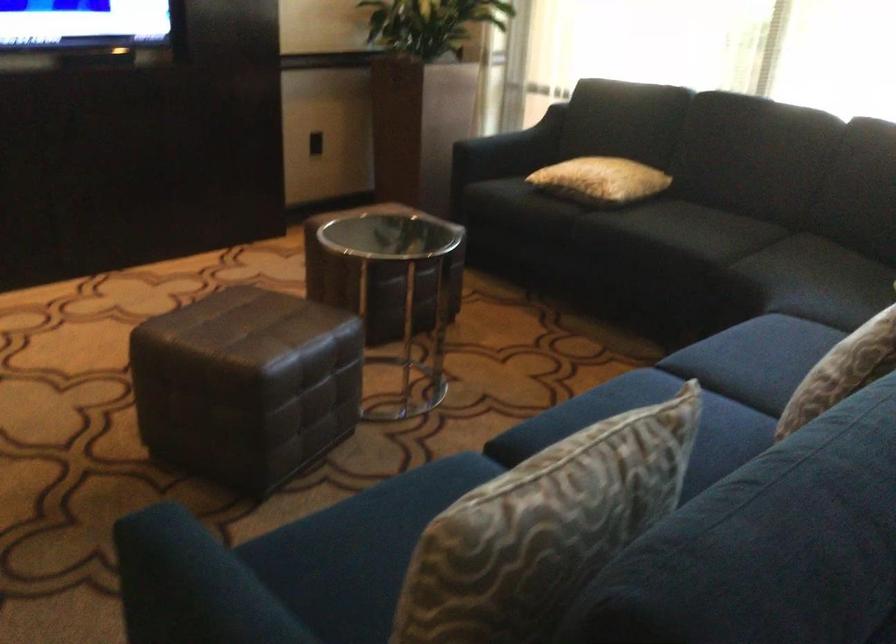
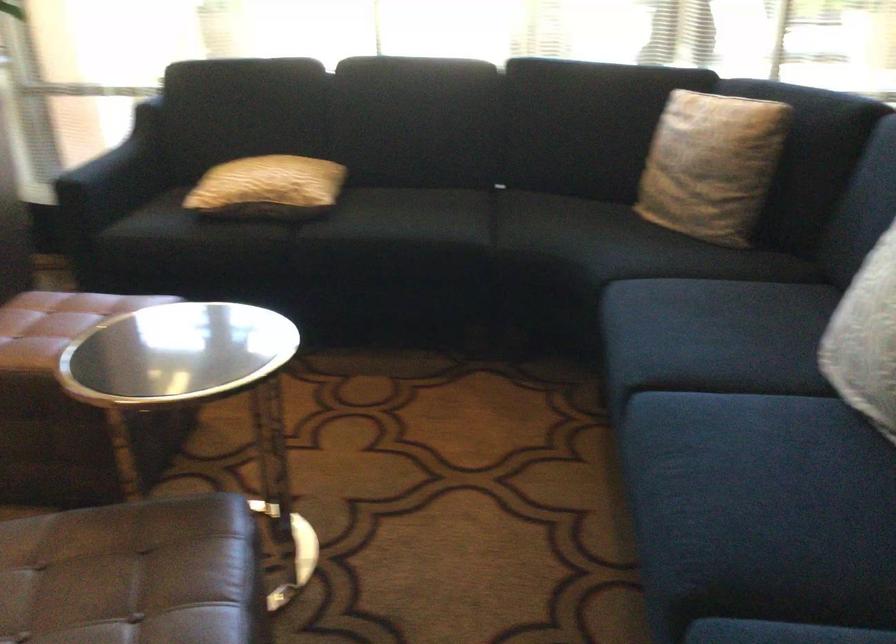
The point at (269, 327) is marked in the first image. Where is the corresponding point in the second image?

(134, 574)